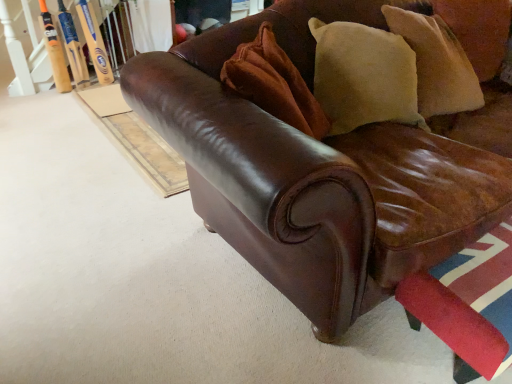
Question: Is beige suede pillow at upper right, the second pillow when ordered from left to right, positioned with its back to orange wood baseball bat at upper left, the first baseball bat when ordered from left to right?

Choices:
 (A) yes
 (B) no

Answer: (B)

Question: Is beige suede pillow at upper right, which ranks as the 2th pillow in front-to-back order, positioned far away from orange wood baseball bat at upper left, the first baseball bat when ordered from left to right?

Choices:
 (A) no
 (B) yes

Answer: (B)

Question: Can you confirm if beige suede pillow at upper right, which ranks as the 2th pillow in front-to-back order, is thinner than orange wood baseball bat at upper left, the first baseball bat when ordered from left to right?

Choices:
 (A) yes
 (B) no

Answer: (B)

Question: Is beige suede pillow at upper right, which ranks as the 2th pillow in front-to-back order, touching orange wood baseball bat at upper left, the 2th baseball bat from the right?

Choices:
 (A) yes
 (B) no

Answer: (B)

Question: Considering the relative sizes of beige suede pillow at upper right, positioned as the first pillow in right-to-left order, and orange wood baseball bat at upper left, the first baseball bat when ordered from left to right, in the image provided, is beige suede pillow at upper right, positioned as the first pillow in right-to-left order, wider than orange wood baseball bat at upper left, the first baseball bat when ordered from left to right,?

Choices:
 (A) yes
 (B) no

Answer: (A)

Question: Looking at their shapes, would you say beige suede pillow at upper right, positioned as the first pillow in right-to-left order, is wider or thinner than orange wood baseball bat at upper left, the 2th baseball bat from the right?

Choices:
 (A) thin
 (B) wide

Answer: (B)

Question: Considering the positions of beige suede pillow at upper right, which appears as the 1th pillow when viewed from the back, and orange wood baseball bat at upper left, the first baseball bat when ordered from left to right, in the image, is beige suede pillow at upper right, which appears as the 1th pillow when viewed from the back, taller or shorter than orange wood baseball bat at upper left, the first baseball bat when ordered from left to right,?

Choices:
 (A) tall
 (B) short

Answer: (B)

Question: Is beige suede pillow at upper right, which ranks as the 2th pillow in front-to-back order, situated inside orange wood baseball bat at upper left, the first baseball bat when ordered from left to right, or outside?

Choices:
 (A) inside
 (B) outside

Answer: (B)

Question: From a real-world perspective, is beige suede pillow at upper right, the second pillow when ordered from left to right, physically located above or below orange wood baseball bat at upper left, the 2th baseball bat from the right?

Choices:
 (A) below
 (B) above

Answer: (B)

Question: Is wooden baseball bat at upper left, the 2th baseball bat when ordered from left to right, spatially inside orange wood baseball bat at upper left, the first baseball bat when ordered from left to right, or outside of it?

Choices:
 (A) outside
 (B) inside

Answer: (A)

Question: Considering the positions of wooden baseball bat at upper left, the 2th baseball bat when ordered from left to right, and orange wood baseball bat at upper left, the first baseball bat when ordered from left to right, in the image, is wooden baseball bat at upper left, the 2th baseball bat when ordered from left to right, wider or thinner than orange wood baseball bat at upper left, the first baseball bat when ordered from left to right,?

Choices:
 (A) thin
 (B) wide

Answer: (B)

Question: Is wooden baseball bat at upper left, the 2th baseball bat when ordered from left to right, bigger or smaller than orange wood baseball bat at upper left, the 2th baseball bat from the right?

Choices:
 (A) big
 (B) small

Answer: (A)

Question: Considering the positions of point (87, 21) and point (67, 87), is point (87, 21) closer or farther from the camera than point (67, 87)?

Choices:
 (A) farther
 (B) closer

Answer: (B)

Question: From a real-world perspective, relative to velvet beige pillow at upper right, placed as the second pillow when sorted from back to front, is wooden baseball bat at upper left, which is the first baseball bat from right to left, vertically above or below?

Choices:
 (A) below
 (B) above

Answer: (A)

Question: Considering the positions of wooden baseball bat at upper left, which is the first baseball bat from right to left, and velvet beige pillow at upper right, marked as the second pillow in a right-to-left arrangement, in the image, is wooden baseball bat at upper left, which is the first baseball bat from right to left, wider or thinner than velvet beige pillow at upper right, marked as the second pillow in a right-to-left arrangement,?

Choices:
 (A) wide
 (B) thin

Answer: (B)